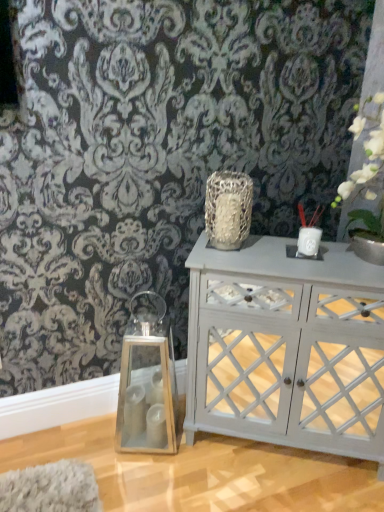
The image size is (384, 512). I want to click on vacant region to the right of white ceramic vase at upper right, arranged as the 3th candle holder when ordered from the bottom, so click(x=341, y=255).